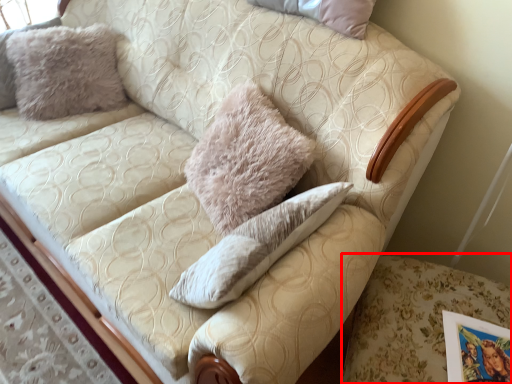
Question: From the image's perspective, where is swivel chair (annotated by the red box) located relative to pillow?

Choices:
 (A) above
 (B) below

Answer: (B)